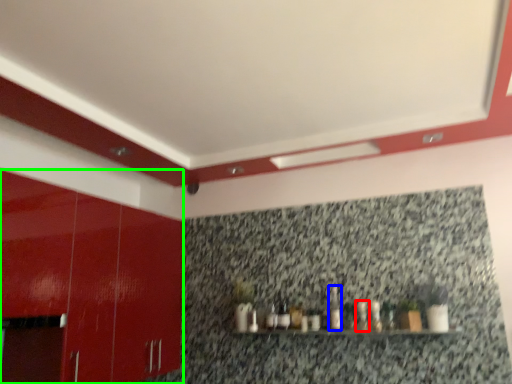
Question: Estimate the real-world distances between objects in this image. Which object is closer to bottle (highlighted by a red box), bottle (highlighted by a blue box) or cabinetry (highlighted by a green box)?

Choices:
 (A) bottle
 (B) cabinetry

Answer: (A)